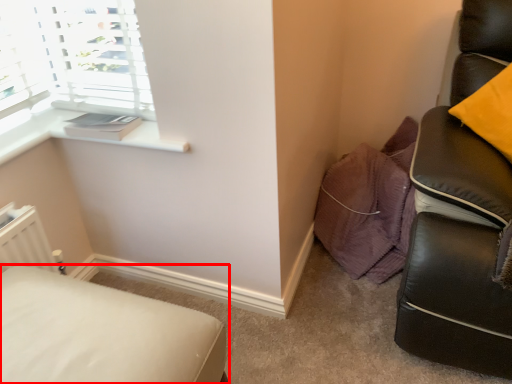
Question: Considering the relative positions of furniture (annotated by the red box) and window sill in the image provided, where is furniture (annotated by the red box) located with respect to the staircase?

Choices:
 (A) left
 (B) right

Answer: (A)